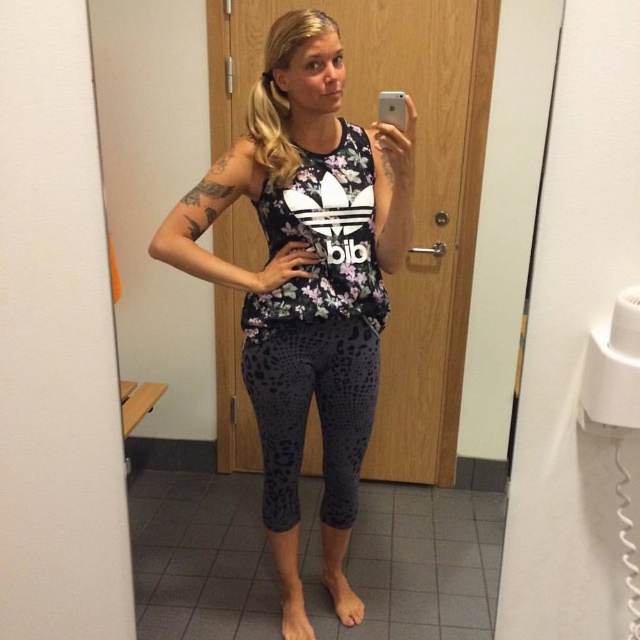
You are standing in a restroom and want to take a selfie with your phone. Your right hand is holding the phone at point (321, 356). If your eyes are at 1.7 meters tall, will the phone be at a comfortable viewing distance for your eyes?

The distance between your eyes and the phone is 1.77 meters. Since the phone is held at point (321, 356), which is 1.77 meters away from your eyes, this distance may be too far for comfortable viewing as most people hold their phones around 30 cm to 50 cm from their face.

In the scene shown: The person in the image is holding a smartphone to take a selfie. How far apart are the floral fabric tank top at center and the smartphone?

The floral fabric tank top at center and the smartphone are 4.67 feet apart.

You are a fashion designer analyzing the outfit of the person in the image. Which piece of clothing, the floral fabric tank top at center or the dark gray leopard print leggings at center, has a more prominent visual presence in the outfit?

The floral fabric tank top at center has a larger size compared to the dark gray leopard print leggings at center, so it has a more prominent visual presence in the outfit.